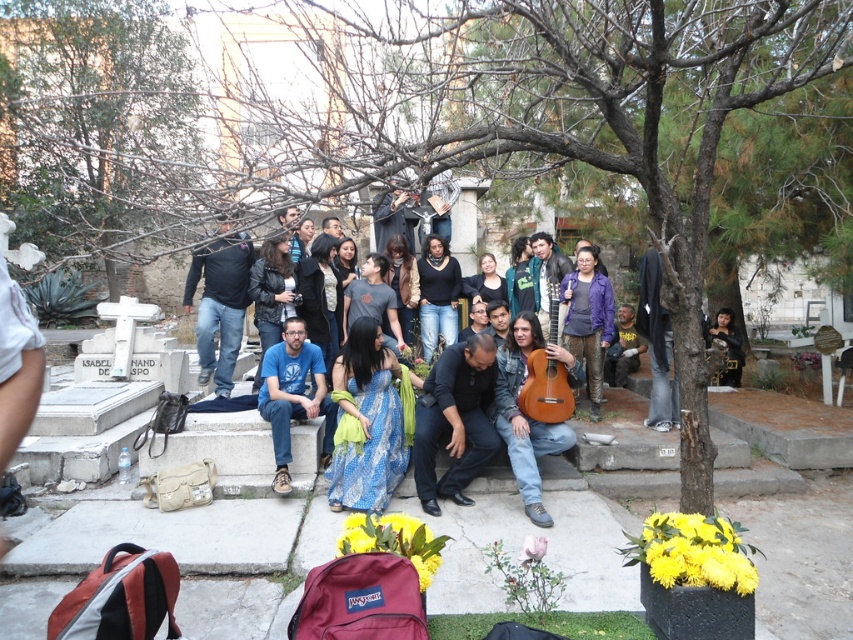
You are a photographer positioned at the brown leafless branches at upper left and want to take a photo of the blue batik dress at center. Given that your camera has a maximum focus range of 5 meters, will you be able to capture the dress clearly?

The distance between the brown leafless branches at upper left and the blue batik dress at center is 5.65 meters. Since the camera can only focus up to 5 meters, it won not be able to capture the dress clearly.

You are a photographer taking a picture of the group at the cemetery. You notice the black matte pants at center and the blue cotton shirt at center. Which clothing item is shorter in length?

The black matte pants at center is shorter than the blue cotton shirt at center.